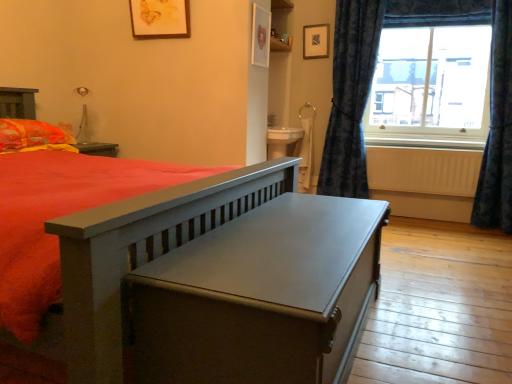
Question: In terms of width, does matte gray table at center look wider or thinner when compared to white painted wood at right?

Choices:
 (A) thin
 (B) wide

Answer: (B)

Question: From the image's perspective, is matte gray table at center above or below white painted wood at right?

Choices:
 (A) above
 (B) below

Answer: (B)

Question: Which object is positioned closest to the matte wooden picture frame at upper center, which is counted as the 2th picture frame, starting from the right?

Choices:
 (A) white matte radiator at lower right
 (B) matte black picture frame at upper center, the first picture frame viewed from the back
 (C) matte gray table at center
 (D) blue textured curtain at right, the second curtain viewed from the right
 (E) orange/yellow fabric pillow at left

Answer: (E)

Question: Estimate the real-world distances between objects in this image. Which object is farther from the clear glass window at upper right?

Choices:
 (A) white painted wood at right
 (B) white matte radiator at lower right
 (C) blue textured curtain at right, the first curtain viewed from the left
 (D) matte gray table at center
 (E) orange/yellow fabric pillow at left

Answer: (E)